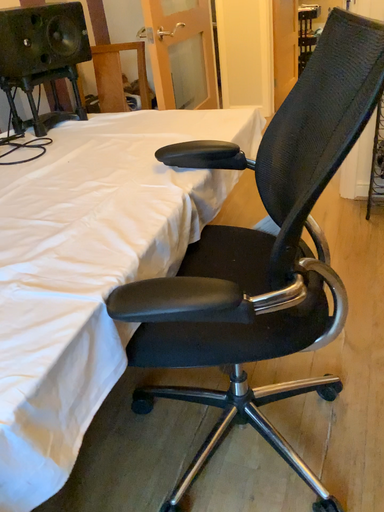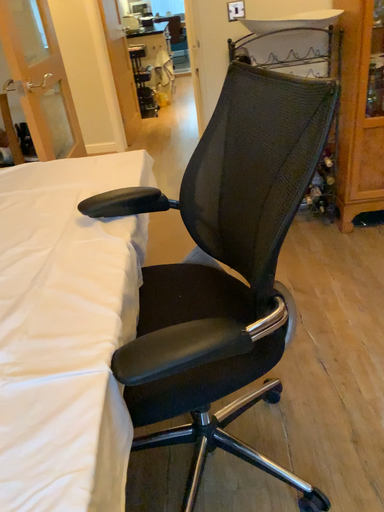
Question: Which way did the camera rotate in the video?

Choices:
 (A) rotated right
 (B) rotated left

Answer: (A)